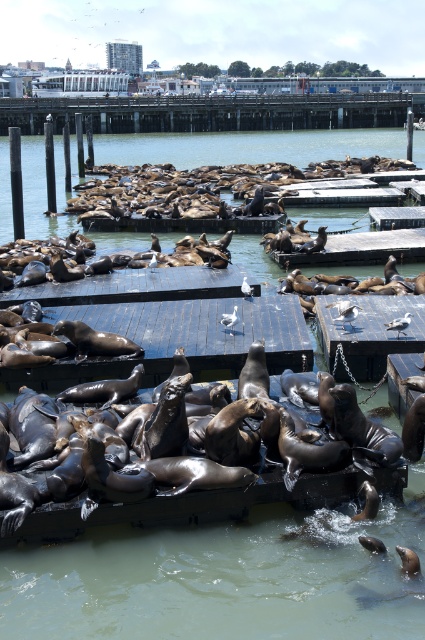
You are standing on the wooden dock at center and want to jump onto the black wood dock at center. Based on the height difference between them, do you think this is a safe jump?

The wooden dock at center has a greater height compared to the black wood dock at center. Jumping from a higher platform to a lower one could be risky due to the drop, so it might not be safe.

You are standing at the edge of the dock and want to take a photo of both point (376, 100) and point (192, 273) in the scene. Which point should you focus on first to ensure both are in clear view?

You should focus on point (376, 100) first because it is closer to the camera than point (192, 273), ensuring both points are in focus when using a shallow depth of field.

You are a sea lion trying to find a wider platform to rest on. You see the wooden dock at center and the smooth wooden dock at upper center. Which one should you choose?

The smooth wooden dock at upper center is wider than the wooden dock at center, so you should choose the smooth wooden dock at upper center to rest on.